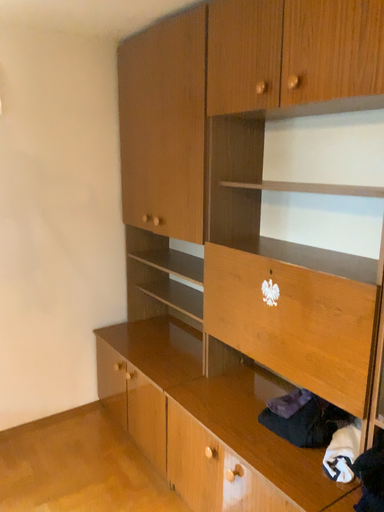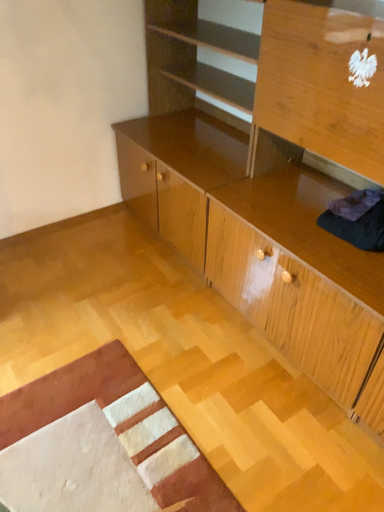
Question: Which way did the camera rotate in the video?

Choices:
 (A) rotated downward
 (B) rotated upward

Answer: (A)